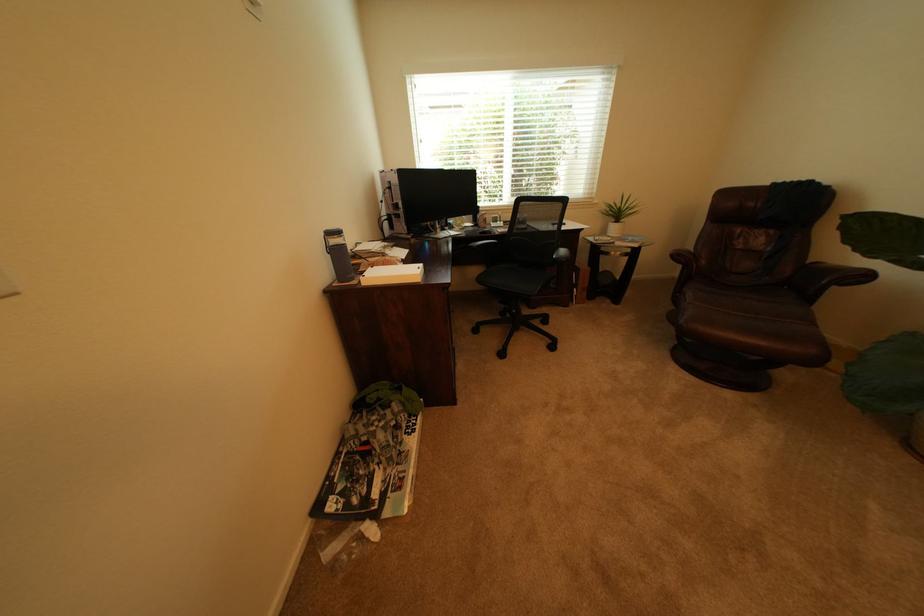
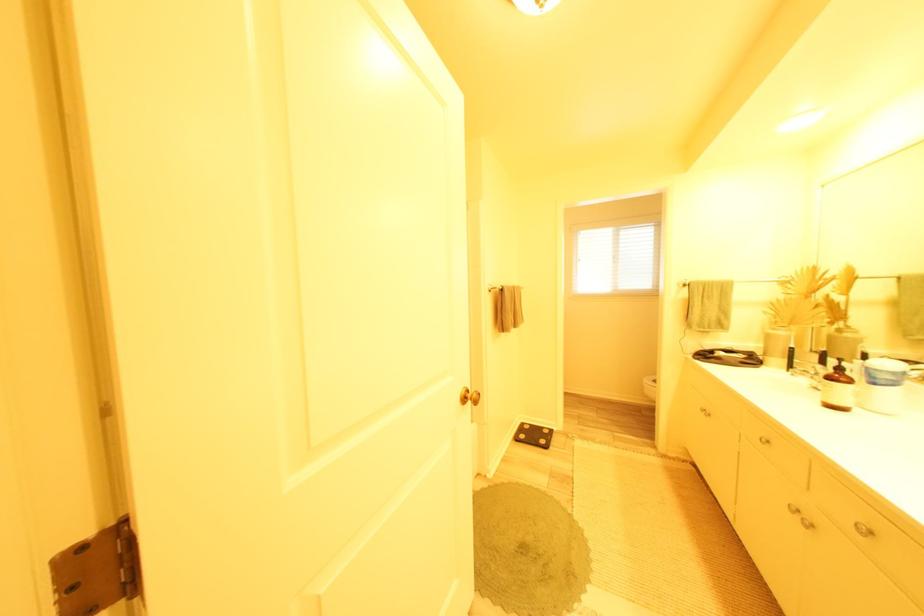
Question: I am providing you with two images of the same scene from different viewpoints. After the viewpoint changes to image2, which objects are now occluded?

Choices:
 (A) faucet handle
 (B) black chair sitting surface
 (C) small green pot
 (D) blue jar lid

Answer: (B)